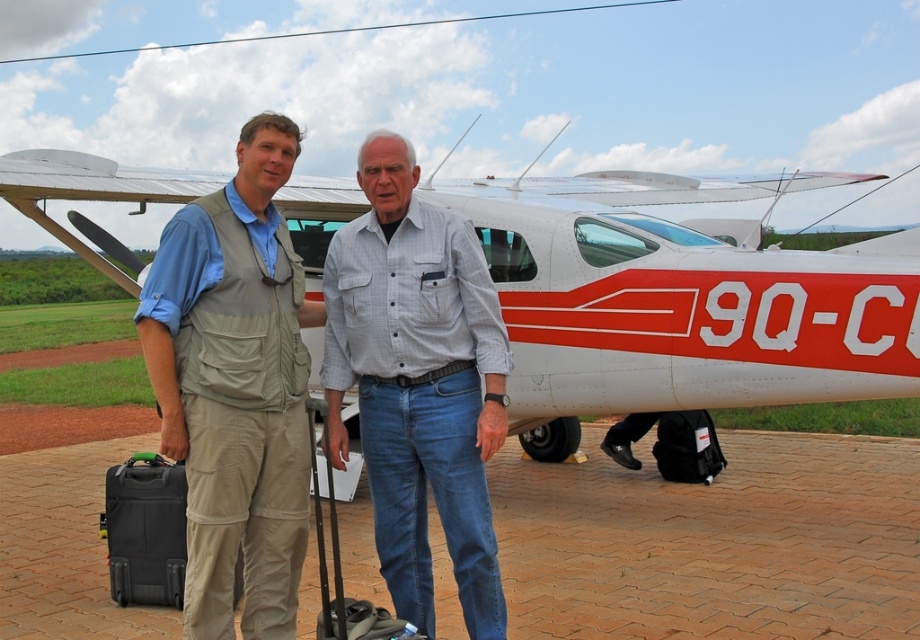
Is white matte airplane at center closer to the viewer compared to black hardshell suitcase at lower left?

That is False.

Between point (844, 280) and point (142, 464), which one is positioned in front?

Point (142, 464) is more forward.

Between point (142, 186) and point (158, 604), which one is positioned in front?

Point (158, 604) is more forward.

This screenshot has width=920, height=640. I want to click on white matte airplane at center, so click(681, 301).

Which is more to the left, white matte airplane at center or denim suitcase at lower center?

From the viewer's perspective, denim suitcase at lower center appears more on the left side.

What do you see at coordinates (681, 301) in the screenshot? This screenshot has width=920, height=640. I see `white matte airplane at center` at bounding box center [681, 301].

Image resolution: width=920 pixels, height=640 pixels. What do you see at coordinates (681, 301) in the screenshot?
I see `white matte airplane at center` at bounding box center [681, 301].

Where is `white matte airplane at center`? This screenshot has height=640, width=920. white matte airplane at center is located at coordinates (681, 301).

Which is behind, point (426, 284) or point (323, 589)?

The point (426, 284) is behind.

Who is more forward, (x=412, y=308) or (x=324, y=598)?

Positioned in front is point (x=324, y=598).

The width and height of the screenshot is (920, 640). Find the location of `gray cotton shirt at center`. gray cotton shirt at center is located at coordinates (418, 384).